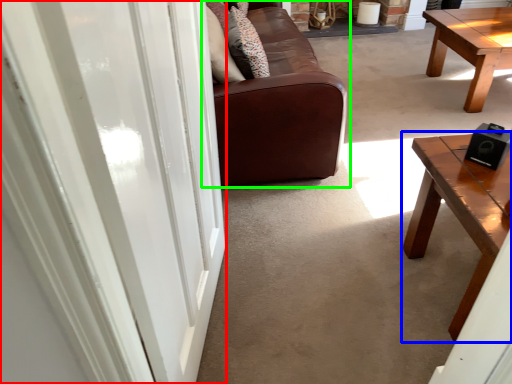
Question: Estimate the real-world distances between objects in this image. Which object is farther from screen door (highlighted by a red box), coffee table (highlighted by a blue box) or studio couch (highlighted by a green box)?

Choices:
 (A) coffee table
 (B) studio couch

Answer: (B)